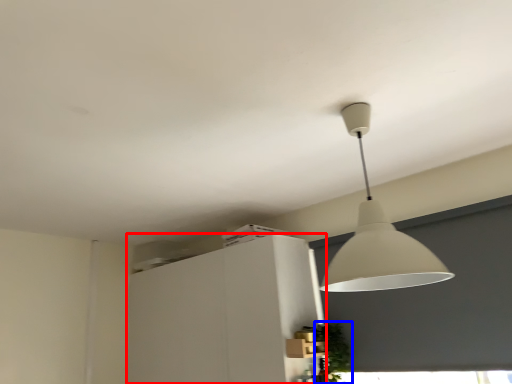
Question: Which of the following is the farthest to the observer, cabinetry (highlighted by a red box) or plant (highlighted by a blue box)?

Choices:
 (A) cabinetry
 (B) plant

Answer: (A)